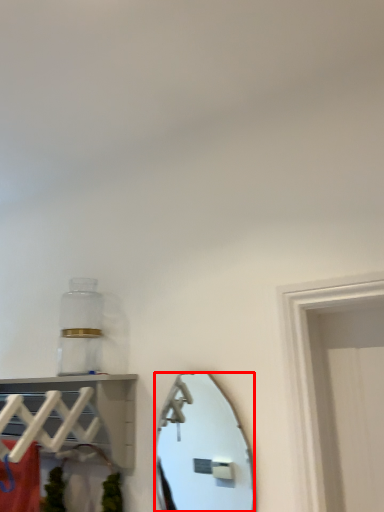
Question: From the image's perspective, what is the correct spatial relationship of mirror (annotated by the red box) in relation to shelf?

Choices:
 (A) above
 (B) below

Answer: (B)